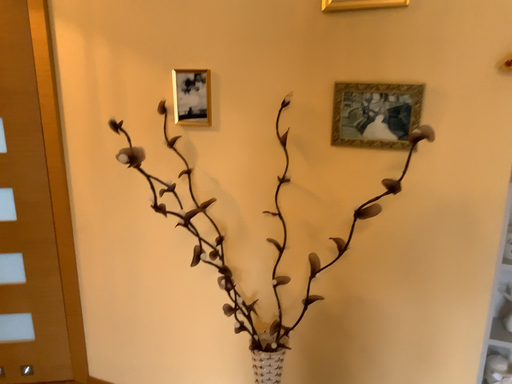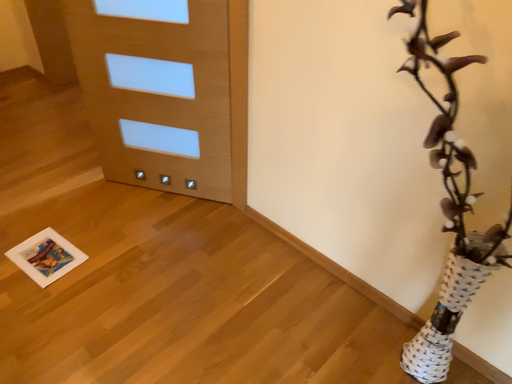
Question: How did the camera likely rotate when shooting the video?

Choices:
 (A) rotated right
 (B) rotated left

Answer: (B)